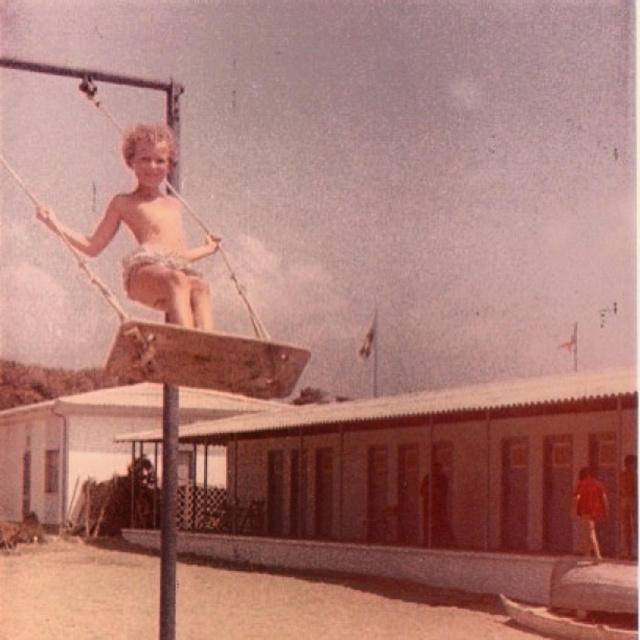
You are a photographer trying to capture the metallic pole at center and the matte red shirt at right in a single frame. Given that your camera can only focus on objects within a 100cm width, will both objects fit in the frame if they are placed side by side?

The metallic pole at center is bigger than the matte red shirt at right, so when placed side by side, their combined width may exceed the camera frame limit of 100cm. However, without specific measurements, it is uncertain. The description only states the relative size, not exact dimensions.

You are a photographer analyzing the composition of this vintage image. The subject, the smooth skin shirtless boy at center, is positioned at coordinates 0.794 on the x axis and 0.681 on the y axis. Based on standard photographic framing rules, does this placement align with the rule of thirds? Please explain your reasoning.

The rule of thirds divides the image into a 3x3 grid. The coordinates of the smooth skin shirtless boy at center at 0.794 on the x axis and 0.681 on the y axis place him near the intersection of the rightmost and upper horizontal lines. Since these intersections are key focal points according to the rule of thirds, this placement does align with the rule of thirds.

You are a photographer trying to capture the boy on the wooden signpost. You notice two points in the scene at coordinates point [230,380] and point [588,532]. Which point is closer to your camera lens?

Point [230,380] is closer to the camera than point [588,532].